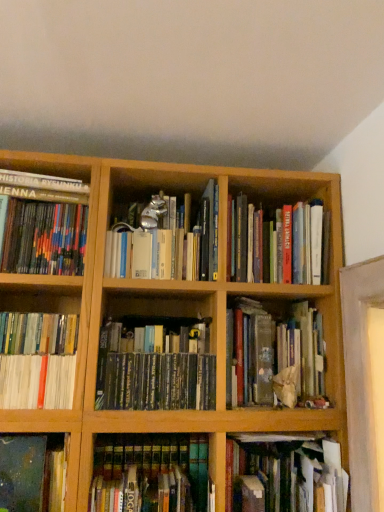
Describe the element at coordinates (166, 242) in the screenshot. The width and height of the screenshot is (384, 512). I see `metallic silver figurine at center, the sixth book in the left-to-right sequence` at that location.

Find the location of `hardcover books at center, the second book viewed from the right`. hardcover books at center, the second book viewed from the right is located at coordinates (279, 243).

The image size is (384, 512). Identify the location of hardcover books at center, the fifth book viewed from the left. (x=152, y=475).

What do you see at coordinates (272, 353) in the screenshot? I see `green matte book at center, the 1th book positioned from the right` at bounding box center [272, 353].

This screenshot has height=512, width=384. What do you see at coordinates (153, 378) in the screenshot?
I see `green matte book at center, acting as the fourth book starting from the left` at bounding box center [153, 378].

Image resolution: width=384 pixels, height=512 pixels. In order to click on green matte book at center, which is counted as the 6th book, starting from the right in this screenshot , I will do `click(153, 378)`.

Where is `metallic silver figurine at center, the sixth book in the left-to-right sequence`? metallic silver figurine at center, the sixth book in the left-to-right sequence is located at coordinates (166, 242).

Based on the photo, from the image's perspective, which one is positioned higher, hardcover books at center, placed as the fifth book when sorted from right to left, or hardcover books at center, placed as the 8th book when sorted from left to right?

hardcover books at center, placed as the 8th book when sorted from left to right, appears higher in the image.

Is hardcover books at center, the fifth book viewed from the left, smaller than hardcover books at center, the second book viewed from the right?

Yes.

Is hardcover books at center, placed as the fifth book when sorted from right to left, wider than hardcover books at center, placed as the 8th book when sorted from left to right?

No, hardcover books at center, placed as the fifth book when sorted from right to left, is not wider than hardcover books at center, placed as the 8th book when sorted from left to right.

Would you say hardcover books at center, placed as the 8th book when sorted from left to right, is outside white glossy book at lower left, the second book positioned from the left?

hardcover books at center, placed as the 8th book when sorted from left to right, is positioned outside white glossy book at lower left, the second book positioned from the left.

In the scene shown: Which is more to the left, hardcover books at center, placed as the 8th book when sorted from left to right, or white glossy book at lower left, the eighth book in the right-to-left sequence?

Positioned to the left is white glossy book at lower left, the eighth book in the right-to-left sequence.

In terms of width, does hardcover books at center, placed as the 8th book when sorted from left to right, look wider or thinner when compared to white glossy book at lower left, the eighth book in the right-to-left sequence?

Considering their sizes, hardcover books at center, placed as the 8th book when sorted from left to right, looks broader than white glossy book at lower left, the eighth book in the right-to-left sequence.

Is hardcover books at center, placed as the 8th book when sorted from left to right, oriented away from multicolored hardcover books at left, acting as the first book starting from the left?

That's not correct — hardcover books at center, placed as the 8th book when sorted from left to right, is not looking away from multicolored hardcover books at left, acting as the first book starting from the left.

Considering the sizes of hardcover books at center, placed as the 8th book when sorted from left to right, and multicolored hardcover books at left, the 9th book from the right, in the image, is hardcover books at center, placed as the 8th book when sorted from left to right, taller or shorter than multicolored hardcover books at left, the 9th book from the right,?

hardcover books at center, placed as the 8th book when sorted from left to right, is taller than multicolored hardcover books at left, the 9th book from the right.

Which object is thinner, hardcover books at center, the second book viewed from the right, or multicolored hardcover books at left, acting as the first book starting from the left?

Thinner between the two is multicolored hardcover books at left, acting as the first book starting from the left.

Would you say hardcover books at center, placed as the 8th book when sorted from left to right, is inside or outside multicolored hardcover books at left, the 9th book from the right?

hardcover books at center, placed as the 8th book when sorted from left to right, is not enclosed by multicolored hardcover books at left, the 9th book from the right.

Does point (54, 357) come closer to viewer compared to point (21, 237)?

Yes.

Is white glossy book at lower left, the eighth book in the right-to-left sequence, directly adjacent to multicolored hardcover books at left, acting as the first book starting from the left?

There is a gap between white glossy book at lower left, the eighth book in the right-to-left sequence, and multicolored hardcover books at left, acting as the first book starting from the left.

Does white glossy book at lower left, the second book positioned from the left, come behind multicolored hardcover books at left, the 9th book from the right?

No, the depth of white glossy book at lower left, the second book positioned from the left, is less than that of multicolored hardcover books at left, the 9th book from the right.

Which of these two, white glossy book at lower left, the eighth book in the right-to-left sequence, or multicolored hardcover books at left, acting as the first book starting from the left, is wider?

With larger width is multicolored hardcover books at left, acting as the first book starting from the left.

From a real-world perspective, relative to white glossy book at lower left, the eighth book in the right-to-left sequence, is green matte book at center, acting as the fourth book starting from the left, vertically above or below?

From a real-world perspective, green matte book at center, acting as the fourth book starting from the left, is physically below white glossy book at lower left, the eighth book in the right-to-left sequence.

Where is `book that is the 1st one below the white glossy book at lower left, the eighth book in the right-to-left sequence (from a real-world perspective)`? The height and width of the screenshot is (512, 384). book that is the 1st one below the white glossy book at lower left, the eighth book in the right-to-left sequence (from a real-world perspective) is located at coordinates (153, 378).

Is white glossy book at lower left, the second book positioned from the left, completely or partially inside green matte book at center, acting as the fourth book starting from the left?

No, white glossy book at lower left, the second book positioned from the left, is not inside green matte book at center, acting as the fourth book starting from the left.

How much distance is there between green matte book at center, which is counted as the 6th book, starting from the right, and white glossy book at lower left, the eighth book in the right-to-left sequence?

green matte book at center, which is counted as the 6th book, starting from the right, is 8.27 inches away from white glossy book at lower left, the eighth book in the right-to-left sequence.

Looking at this image, is metallic silver figurine at center, the sixth book in the left-to-right sequence, outside of white glossy book at lower left, the second book positioned from the left?

Yes, metallic silver figurine at center, the sixth book in the left-to-right sequence, is located beyond the bounds of white glossy book at lower left, the second book positioned from the left.

Based on the photo, from the image's perspective, relative to white glossy book at lower left, the eighth book in the right-to-left sequence, is metallic silver figurine at center, placed as the fourth book when sorted from right to left, above or below?

Based on their image positions, metallic silver figurine at center, placed as the fourth book when sorted from right to left, is located above white glossy book at lower left, the eighth book in the right-to-left sequence.

From a real-world perspective, between metallic silver figurine at center, placed as the fourth book when sorted from right to left, and white glossy book at lower left, the eighth book in the right-to-left sequence, who is vertically lower?

white glossy book at lower left, the eighth book in the right-to-left sequence.

Considering the relative positions of metallic silver figurine at center, the sixth book in the left-to-right sequence, and white glossy book at lower left, the second book positioned from the left, in the image provided, is metallic silver figurine at center, the sixth book in the left-to-right sequence, to the right of white glossy book at lower left, the second book positioned from the left, from the viewer's perspective?

Yes, metallic silver figurine at center, the sixth book in the left-to-right sequence, is to the right of white glossy book at lower left, the second book positioned from the left.

From the image's perspective, which object appears higher, green matte book at center, which is counted as the 6th book, starting from the right, or dark blue matte book at lower left, acting as the 7th book starting from the right?

green matte book at center, which is counted as the 6th book, starting from the right.

Considering the relative positions of green matte book at center, which is counted as the 6th book, starting from the right, and dark blue matte book at lower left, which is the 3th book from left to right, in the image provided, is green matte book at center, which is counted as the 6th book, starting from the right, to the right of dark blue matte book at lower left, which is the 3th book from left to right, from the viewer's perspective?

Indeed, green matte book at center, which is counted as the 6th book, starting from the right, is positioned on the right side of dark blue matte book at lower left, which is the 3th book from left to right.

Between green matte book at center, which is counted as the 6th book, starting from the right, and dark blue matte book at lower left, which is the 3th book from left to right, which one is positioned behind?

green matte book at center, which is counted as the 6th book, starting from the right, is more distant.

Is green matte book at center, which is counted as the 6th book, starting from the right, completely or partially outside of dark blue matte book at lower left, acting as the 7th book starting from the right?

green matte book at center, which is counted as the 6th book, starting from the right, lies outside dark blue matte book at lower left, acting as the 7th book starting from the right,'s area.

Which book is the 7th one when counting from the front of the hardcover books at center, placed as the 8th book when sorted from left to right? Please provide its 2D coordinates.

[(152, 475)]

The image size is (384, 512). Identify the location of the 4th book behind the white glossy book at lower left, the eighth book in the right-to-left sequence, starting your count from the anchor. (279, 243).

Based on their spatial positions, is hardcover books at center, placed as the fifth book when sorted from right to left, or dark blue matte book at lower left, which is the 3th book from left to right, closer to hardcover book at lower center, the 7th book in the left-to-right sequence?

Among the two, hardcover books at center, placed as the fifth book when sorted from right to left, is located nearer to hardcover book at lower center, the 7th book in the left-to-right sequence.

Considering their positions, is dark blue matte book at lower left, which is the 3th book from left to right, positioned further to green matte book at center, which is counted as the 6th book, starting from the right, than metallic silver figurine at center, placed as the fourth book when sorted from right to left?

dark blue matte book at lower left, which is the 3th book from left to right, is further to green matte book at center, which is counted as the 6th book, starting from the right.

From the picture: When comparing their distances from hardcover book at lower center, the 7th book in the left-to-right sequence, does multicolored hardcover books at left, acting as the first book starting from the left, or green matte book at center, acting as the fourth book starting from the left, seem closer?

green matte book at center, acting as the fourth book starting from the left, is positioned closer to the anchor hardcover book at lower center, the 7th book in the left-to-right sequence.

Based on their spatial positions, is multicolored hardcover books at left, the 9th book from the right, or hardcover books at center, the second book viewed from the right, closer to hardcover books at center, placed as the fifth book when sorted from right to left?

Based on the image, hardcover books at center, the second book viewed from the right, appears to be nearer to hardcover books at center, placed as the fifth book when sorted from right to left.

Which object lies further to the anchor point metallic silver figurine at center, placed as the fourth book when sorted from right to left, green matte book at center, acting as the fourth book starting from the left, or white glossy book at lower left, the second book positioned from the left?

The object further to metallic silver figurine at center, placed as the fourth book when sorted from right to left, is white glossy book at lower left, the second book positioned from the left.

From the picture: When comparing their distances from hardcover books at center, the fifth book viewed from the left, does white glossy book at lower left, the eighth book in the right-to-left sequence, or hardcover book at lower center, which is counted as the third book, starting from the right, seem closer?

Based on the image, hardcover book at lower center, which is counted as the third book, starting from the right, appears to be nearer to hardcover books at center, the fifth book viewed from the left.

Which object lies further to the anchor point multicolored hardcover books at left, acting as the first book starting from the left, hardcover books at center, the fifth book viewed from the left, or hardcover book at lower center, which is counted as the third book, starting from the right?

The object further to multicolored hardcover books at left, acting as the first book starting from the left, is hardcover book at lower center, which is counted as the third book, starting from the right.

Considering their positions, is hardcover books at center, placed as the fifth book when sorted from right to left, positioned closer to metallic silver figurine at center, the sixth book in the left-to-right sequence, than green matte book at center, the 1th book positioned from the right?

green matte book at center, the 1th book positioned from the right, lies closer to metallic silver figurine at center, the sixth book in the left-to-right sequence, than the other object.

You are a GUI agent. You are given a task and a screenshot of the screen. Output one action in this format:
    pyautogui.click(x=<x>, y=<y>)
    Task: Click on the book between white glossy book at lower left, the eighth book in the right-to-left sequence, and green matte book at center, acting as the fourth book starting from the left, from left to right
    
    Given the screenshot: What is the action you would take?
    pyautogui.click(x=31, y=474)